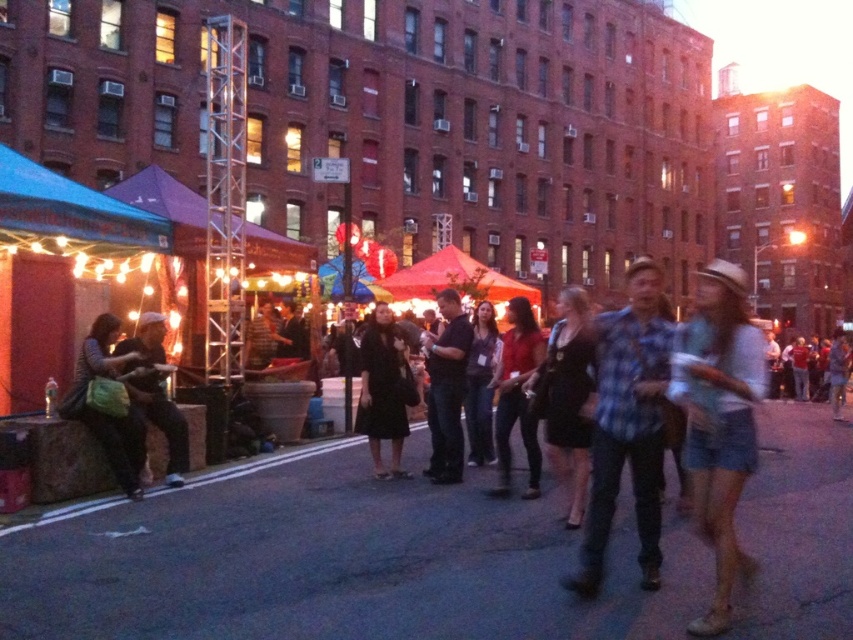
Question: Among these points, which one is nearest to the camera?

Choices:
 (A) (177, 406)
 (B) (651, 440)
 (C) (566, 339)

Answer: (B)

Question: Which point is farther to the camera?

Choices:
 (A) dark gray fabric jacket at center
 (B) red fabric canopy at center
 (C) black matte shirt at center
 (D) blue plaid shirt at center

Answer: (B)

Question: Estimate the real-world distances between objects in this image. Which object is farther from the blue plaid shirt at center?

Choices:
 (A) matte black jacket at left
 (B) matte green bag at left
 (C) blue fabric canopy at left
 (D) dark gray fabric jacket at center

Answer: (C)

Question: Does blue fabric canopy at left have a lesser width compared to matte red shirt at center?

Choices:
 (A) no
 (B) yes

Answer: (A)

Question: Does denim shorts at center appear under dark gray fabric jacket at center?

Choices:
 (A) yes
 (B) no

Answer: (B)

Question: Is blue fabric canopy at left smaller than black leather dress at center?

Choices:
 (A) no
 (B) yes

Answer: (B)